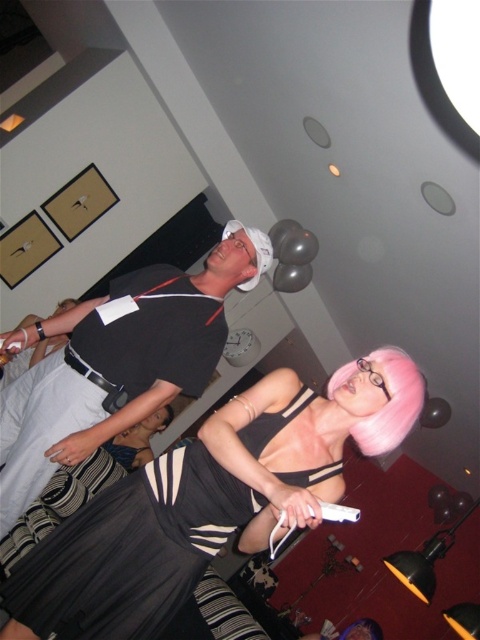
Question: Does black satin dress at center have a smaller size compared to white matte wii remote at center?

Choices:
 (A) no
 (B) yes

Answer: (A)

Question: Considering the real-world distances, which object is farthest from the white matte wii remote at center?

Choices:
 (A) black satin dress at center
 (B) black matte shirt at upper center

Answer: (B)

Question: Does black satin dress at center have a smaller size compared to black matte shirt at upper center?

Choices:
 (A) yes
 (B) no

Answer: (A)

Question: Which point is farther to the camera?

Choices:
 (A) white matte wii remote at center
 (B) black satin dress at center

Answer: (B)

Question: Can you confirm if black satin dress at center is positioned to the left of black matte shirt at upper center?

Choices:
 (A) no
 (B) yes

Answer: (A)

Question: Which of the following is the closest to the observer?

Choices:
 (A) black matte shirt at upper center
 (B) white matte wii remote at center

Answer: (B)